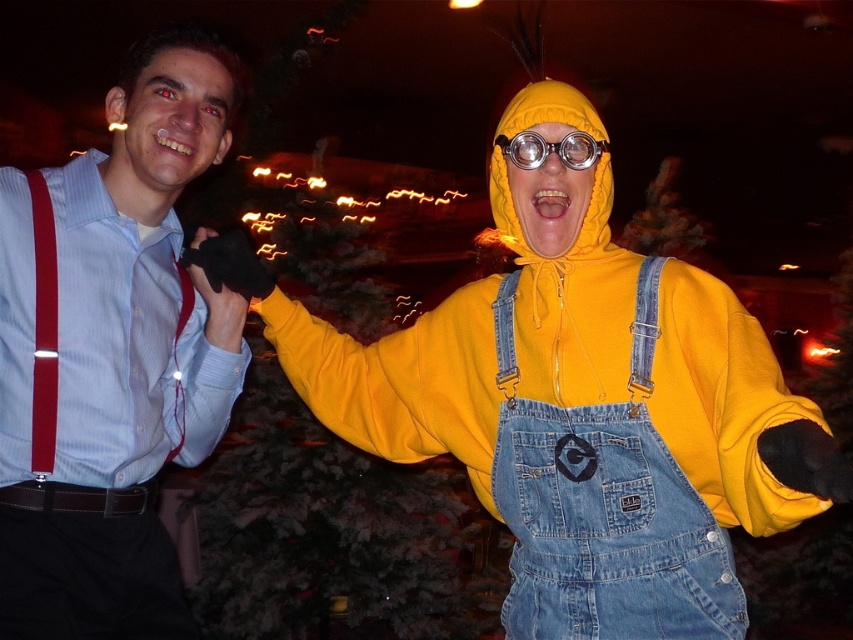
Question: Which is nearer to the brushed metal suspenders at left?

Choices:
 (A) yellow fleece jacket at right
 (B) clear plastic goggles at center

Answer: (A)

Question: Considering the relative positions of brushed metal suspenders at left and yellow fleece jacket at right in the image provided, where is brushed metal suspenders at left located with respect to yellow fleece jacket at right?

Choices:
 (A) left
 (B) right

Answer: (A)

Question: Which point appears farthest from the camera in this image?

Choices:
 (A) (467, 317)
 (B) (517, 132)
 (C) (161, 172)

Answer: (C)

Question: Does brushed metal suspenders at left come in front of clear plastic goggles at center?

Choices:
 (A) no
 (B) yes

Answer: (A)

Question: Which of the following is the closest to the observer?

Choices:
 (A) (578, 160)
 (B) (704, 352)
 (C) (234, 353)

Answer: (B)

Question: Does brushed metal suspenders at left appear on the right side of clear plastic goggles at center?

Choices:
 (A) no
 (B) yes

Answer: (A)